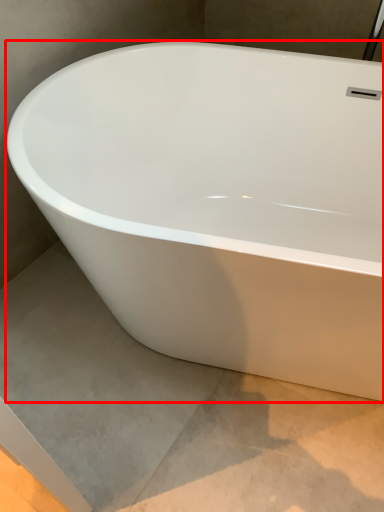
Question: Observing the image, what is the correct spatial positioning of bathtub (annotated by the red box) in reference to concrete?

Choices:
 (A) left
 (B) right

Answer: (B)